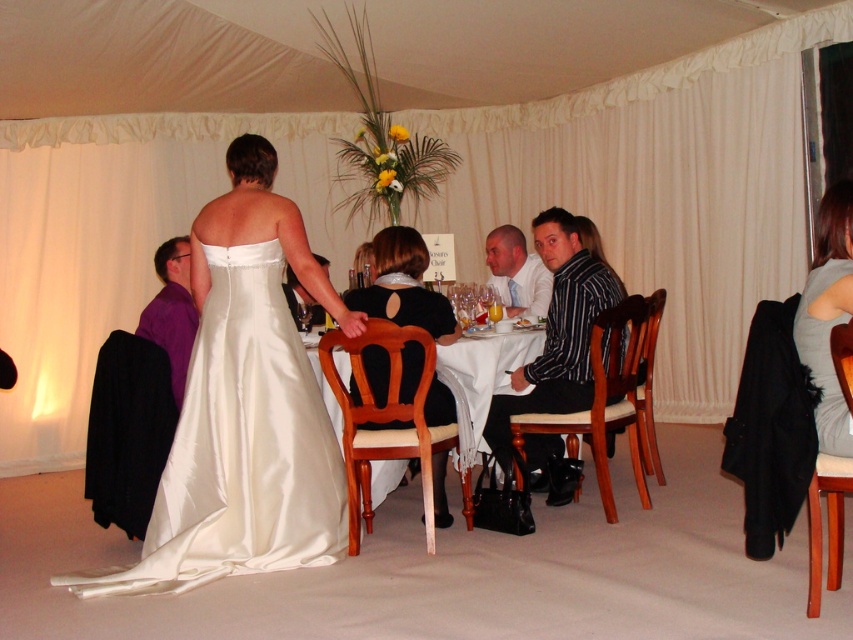
Question: Is striped cotton shirt at center above gray fabric dress at lower right?

Choices:
 (A) no
 (B) yes

Answer: (A)

Question: Does satin white dress at center appear on the right side of matte white shirt at center?

Choices:
 (A) no
 (B) yes

Answer: (A)

Question: Which object appears closest to the camera in this image?

Choices:
 (A) matte white shirt at center
 (B) black satin dress at center
 (C) satin white dress at center

Answer: (C)

Question: Which object is positioned closest to the purple satin shirt at left?

Choices:
 (A) matte white shirt at center
 (B) striped cotton shirt at center

Answer: (B)

Question: Which of the following is the closest to the observer?

Choices:
 (A) purple satin shirt at left
 (B) matte white shirt at center
 (C) gray fabric dress at lower right
 (D) black satin dress at center

Answer: (C)

Question: Is satin white dress at center smaller than matte white shirt at center?

Choices:
 (A) no
 (B) yes

Answer: (A)